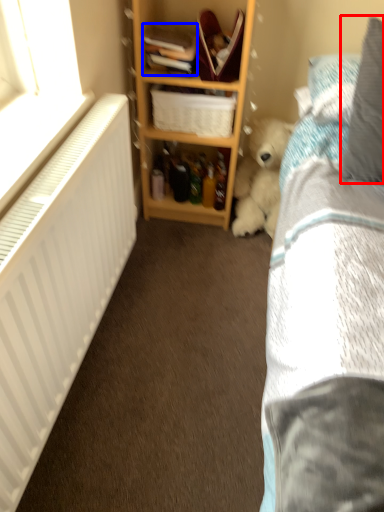
Question: Which point is further to the camera, pillow (highlighted by a red box) or book (highlighted by a blue box)?

Choices:
 (A) pillow
 (B) book

Answer: (B)